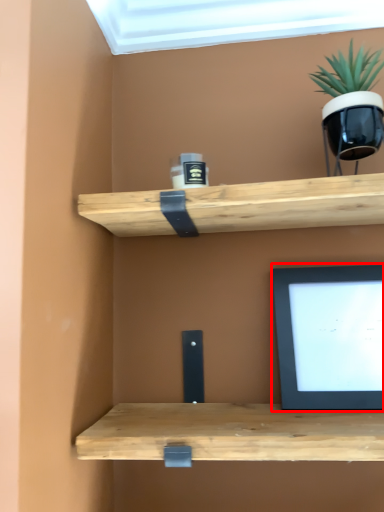
Question: Where is computer monitor (annotated by the red box) located in relation to houseplant in the image?

Choices:
 (A) left
 (B) right

Answer: (A)